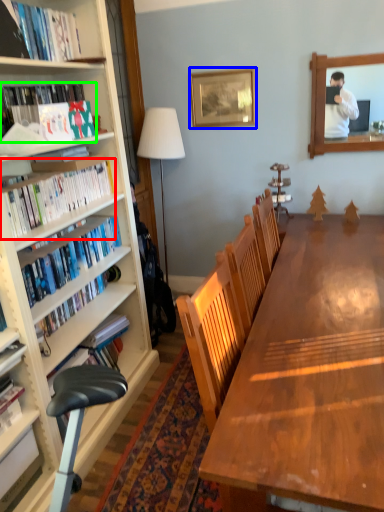
Question: Based on their relative distances, which object is farther from book (highlighted by a red box)? Choose from picture frame (highlighted by a blue box) and book (highlighted by a green box).

Choices:
 (A) picture frame
 (B) book

Answer: (A)